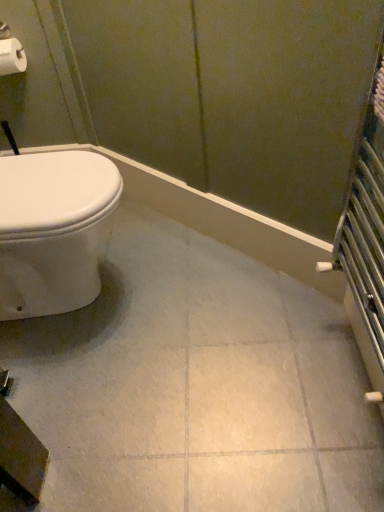
Question: From a real-world perspective, relative to white glossy ceramic tile at center, is white matte toilet paper at upper left vertically above or below?

Choices:
 (A) below
 (B) above

Answer: (B)

Question: Is white matte toilet paper at upper left wider or thinner than white glossy ceramic tile at center?

Choices:
 (A) thin
 (B) wide

Answer: (A)

Question: Is white matte toilet paper at upper left spatially inside white glossy ceramic tile at center, or outside of it?

Choices:
 (A) inside
 (B) outside

Answer: (B)

Question: Do you think white glossy ceramic tile at center is within white matte toilet paper at upper left, or outside of it?

Choices:
 (A) inside
 (B) outside

Answer: (B)

Question: Considering their positions, is white glossy ceramic tile at center located in front of or behind white matte toilet paper at upper left?

Choices:
 (A) behind
 (B) front

Answer: (B)

Question: Based on their positions, is white glossy ceramic tile at center located to the left or right of white matte toilet paper at upper left?

Choices:
 (A) left
 (B) right

Answer: (B)

Question: Is white glossy ceramic tile at center taller or shorter than white matte toilet paper at upper left?

Choices:
 (A) short
 (B) tall

Answer: (A)